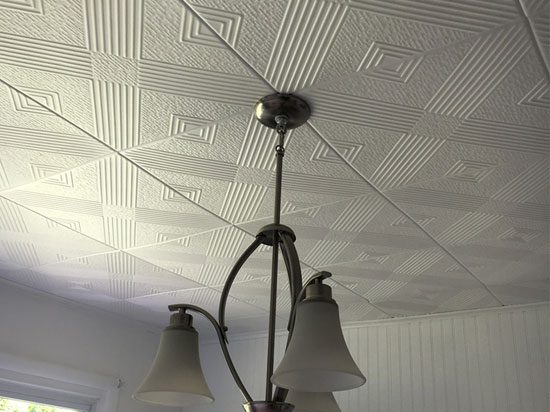
The image size is (550, 412). In order to click on cover in this screenshot , I will do `click(288, 108)`.